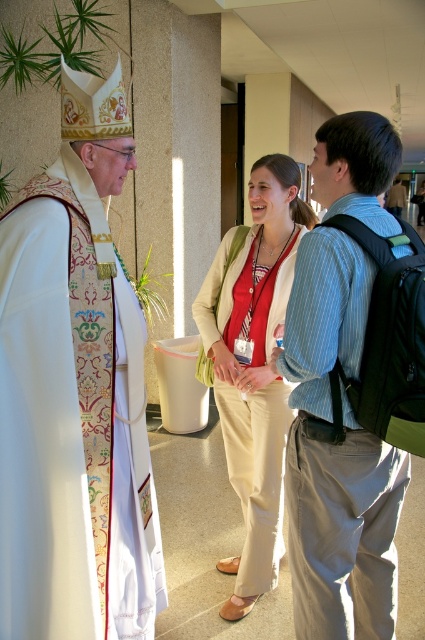
Looking at this image, you are an interior designer assessing the space. You need to place a 1.2 meter wide decorative panel between the embroidered silk robe at left and the striped cotton shirt at center. Will there be enough space?

The embroidered silk robe at left is narrower than the striped cotton shirt at center, but the exact distance between them isn

You are standing at point [36,568] and want to reach the exit located at the opposite side of the room. The exit is 2.5 meters away from your current position. Can you walk straight to the exit without any obstacles?

The distance between you and the exit is 2.5 meters, but the description only mentions a potted plant in the background. There are no other obstacles mentioned, so yes, you can walk straight to the exit.

You are standing at point (x=217, y=369) and want to walk to point (x=51, y=304). Which direction should you face to move towards your destination?

You should face north to move towards point (x=51, y=304) from point (x=217, y=369).